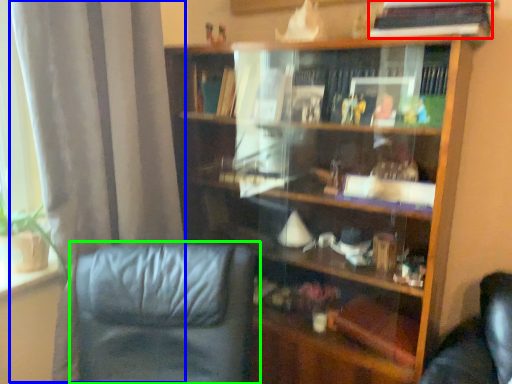
Question: Estimate the real-world distances between objects in this image. Which object is farther from book (highlighted by a red box), curtain (highlighted by a blue box) or chair (highlighted by a green box)?

Choices:
 (A) curtain
 (B) chair

Answer: (B)